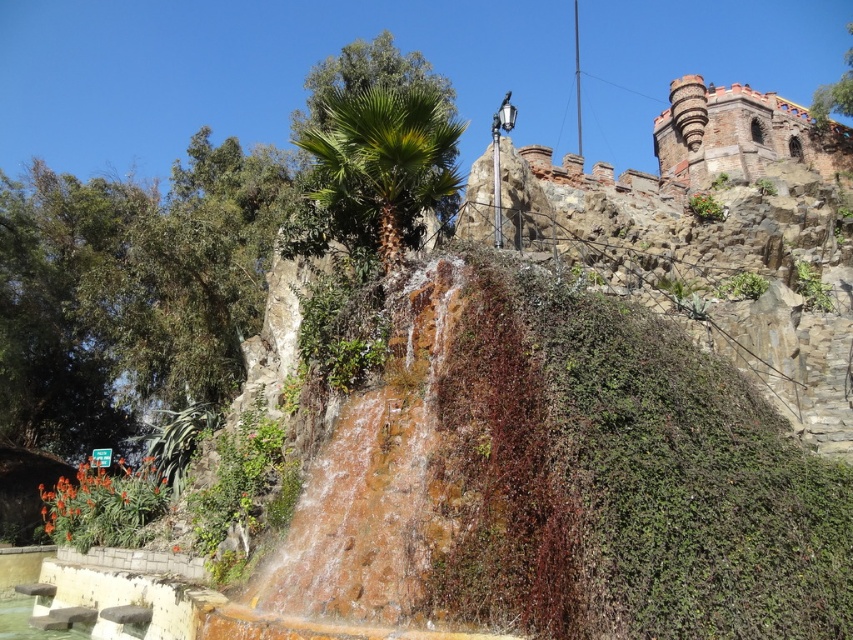
You are standing at the base of the waterfall and want to reach the historic stone structure in the background. There are two points marked on the path ahead of you at coordinates point (341, 124) and point (32, 630). Which point should you head towards to get closer to the stone structure?

Point (32, 630) is further away from the viewer than point (341, 124), so to get closer to the historic stone structure in the background, you should head towards point (32, 630) because it is behind point (341, 124).

You are a visitor standing at the base of the waterfall. You see a green leafy palm at center and clear water at bottom left. Which object is higher in elevation?

The green leafy palm at center is located above the clear water at bottom left, so it is higher in elevation.

You are a visitor standing at the base of the waterfall. You notice a green leafy palm at center and a clear water at bottom left. Which object is higher in this scene?

The green leafy palm at center is taller than clear water at bottom left, so the green leafy palm at center is higher in this scene.